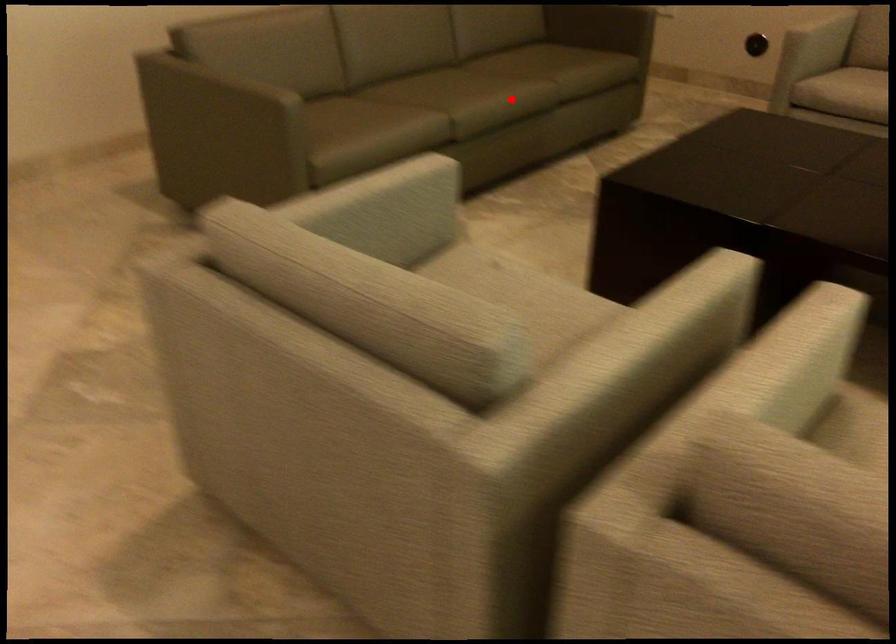
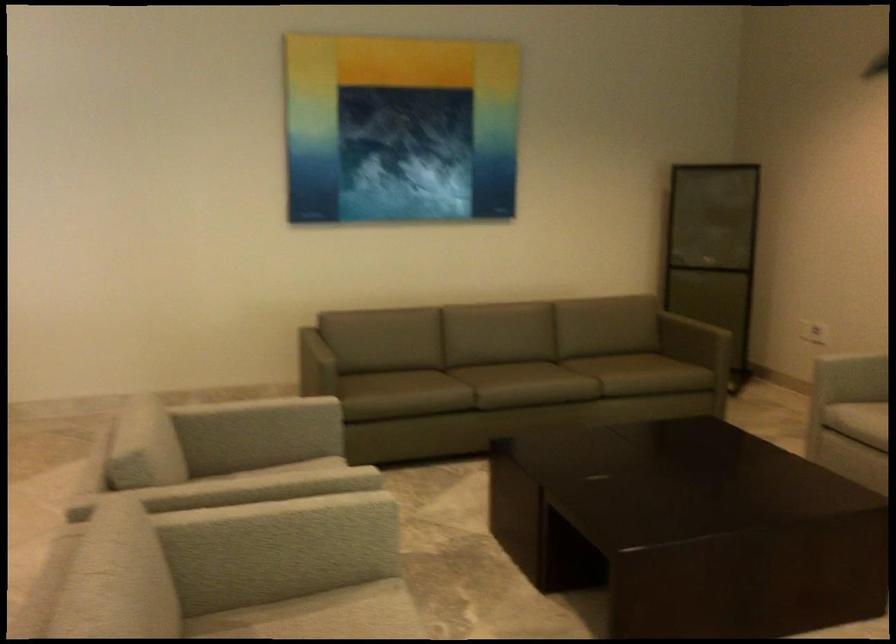
Find the pixel in the second image that matches the highlighted location in the first image.

(524, 384)